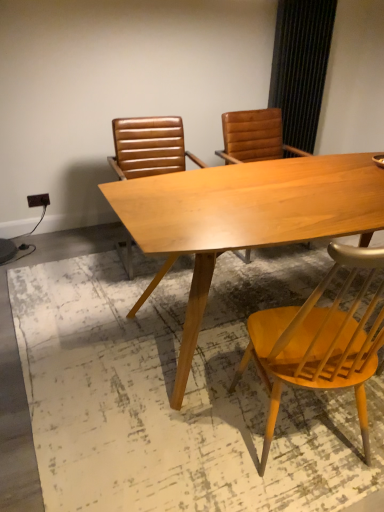
Identify the location of free space to the left of light wood chair at lower right, the first chair when ordered from front to back. (184, 434).